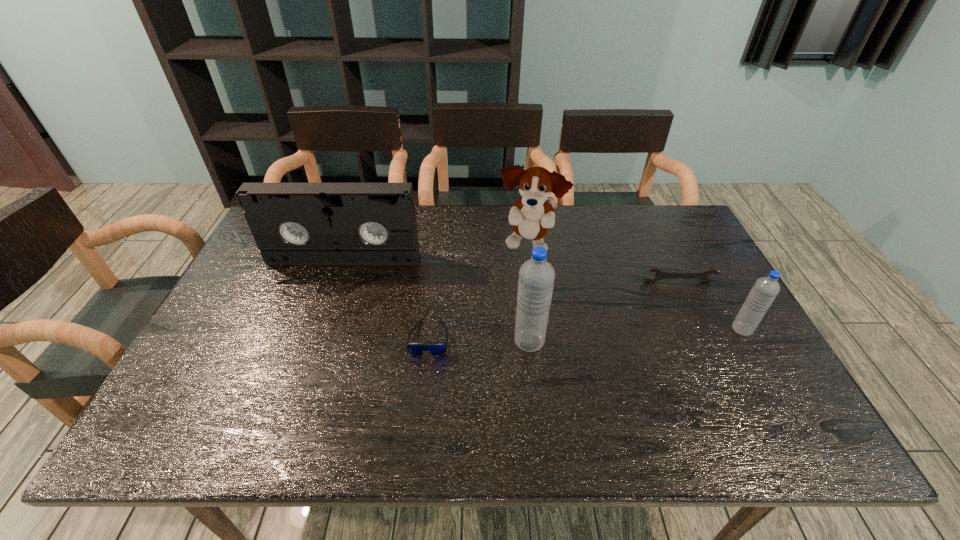
The height and width of the screenshot is (540, 960). Find the location of `vacant space that is in between the left water bottle and the right water bottle`. vacant space that is in between the left water bottle and the right water bottle is located at coordinates (636, 335).

In order to click on free spot between the left water bottle and the right water bottle in this screenshot , I will do `click(636, 335)`.

Identify the location of free space between the puppy and the videotape. The image size is (960, 540). (436, 253).

Find the location of a particular element. Image resolution: width=960 pixels, height=540 pixels. the second closest object to the videotape is located at coordinates (531, 216).

Identify which object is the third nearest to the sunglasses. Please provide its 2D coordinates. Your answer should be formatted as a tuple, i.e. [(x, y)], where the tuple contains the x and y coordinates of a point satisfying the conditions above.

[(531, 216)]

The width and height of the screenshot is (960, 540). Find the location of `vacant space that satisfies the following two spatial constraints: 1. on the face of the right water bottle; 2. on the left side of the puppy`. vacant space that satisfies the following two spatial constraints: 1. on the face of the right water bottle; 2. on the left side of the puppy is located at coordinates (539, 329).

The image size is (960, 540). I want to click on vacant point that satisfies the following two spatial constraints: 1. on the back side of the taller water bottle; 2. on the left side of the right water bottle, so pyautogui.click(x=528, y=329).